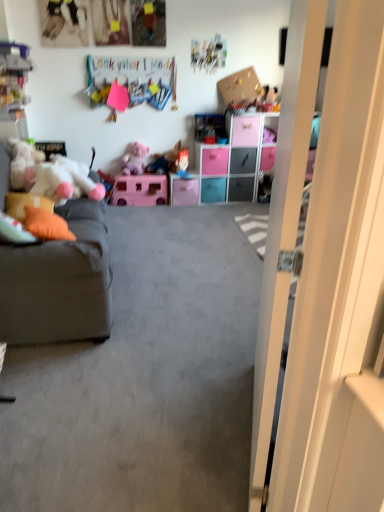
I want to click on free location in front of pink plastic storage unit at center, so 226,218.